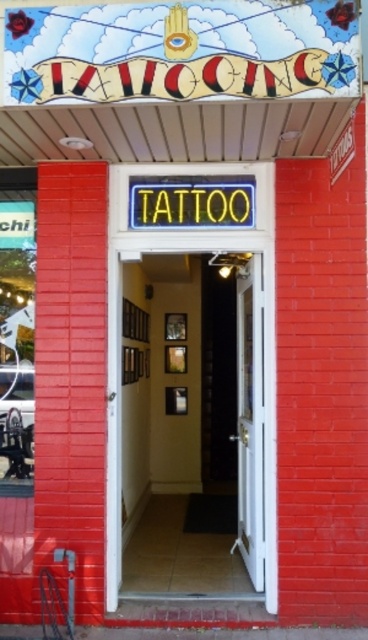
Consider the image. You are standing at the entrance of the tattoo parlor and want to touch the point at coordinates (250, 340). Can you reach it without moving your position?

The point at coordinates (250, 340) is 5.49 meters away from the camera, which means it is too far to reach without moving your position.

You are a delivery person with a large package that requires a doorway width of at least 1 meter to pass through. You are at the entrance of the tattoo parlor and see the white glossy door at center and the white wooden door at center. Which door should you choose to ensure your package can fit through?

The white glossy door at center might be wider than white wooden door at center, so you should choose the white glossy door at center to ensure your package can fit through.